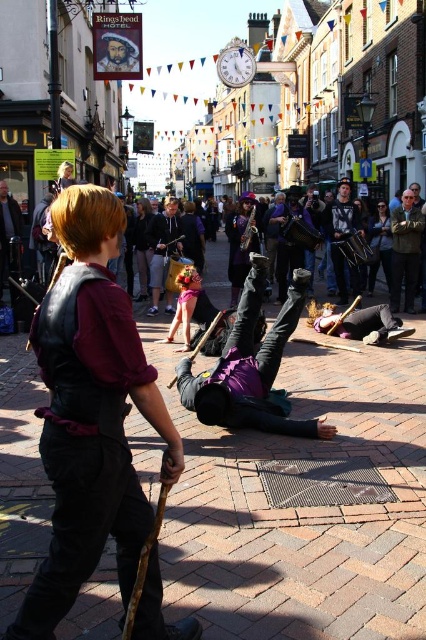
Question: Can you confirm if suede jacket at right is thinner than black leather jacket at center?

Choices:
 (A) yes
 (B) no

Answer: (A)

Question: Does suede jacket at right appear over black leather jacket at center?

Choices:
 (A) yes
 (B) no

Answer: (B)

Question: Among these objects, which one is farthest from the camera?

Choices:
 (A) leather vest at center
 (B) metallic silver clock at upper center
 (C) purple velvet dress at center
 (D) suede jacket at right

Answer: (B)

Question: Which object is closer to the camera taking this photo?

Choices:
 (A) denim jacket at center
 (B) metallic silver clock at upper center

Answer: (A)

Question: Does black leather jacket at center have a smaller size compared to dark brown leather jacket at center?

Choices:
 (A) yes
 (B) no

Answer: (A)

Question: Which of the following is the farthest from the observer?

Choices:
 (A) (383, 260)
 (B) (340, 196)
 (C) (227, 234)

Answer: (C)